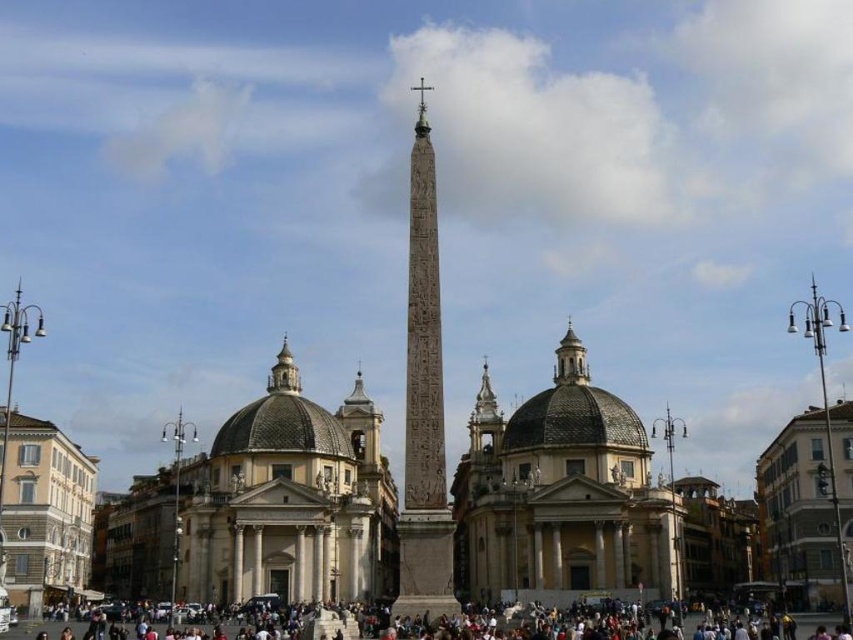
You are an urban planner assessing the space between the beige stone dome at center and the carved stone obelisk at center. Given that the minimum required distance for safety regulations is 60 feet, is the current spacing compliant?

The distance between the beige stone dome at center and the carved stone obelisk at center is 67.16 feet, which exceeds the 60 feet safety requirement, so it is compliant.

You are standing in the urban square and want to take a photo of the carved stone obelisk at center without the beige stone dome at center blocking the view. Is this possible given their positions?

The carved stone obelisk at center is behind the beige stone dome at center, so it would be blocked from view. You cannot take a photo of the carved stone obelisk at center without the beige stone dome at center blocking the view.

You are an architect visiting the urban square and want to take a photo of the carved stone obelisk at center without the matte gray crowd at lower center blocking the view. Based on their sizes, do you think it is possible to frame the obelisk in the shot without the crowd appearing?

The carved stone obelisk at center is larger in size than the matte gray crowd at lower center. Since the obelisk is bigger, it might be possible to frame the shot so that the crowd is either out of the frame or positioned behind the obelisk, but this depends on the camera angle and distance. However, the description only mentions size comparison, so focusing on that, the larger size of the obelisk could allow positioning it centrally while the smaller crowd might be placed at the edges or excluded by zoom.